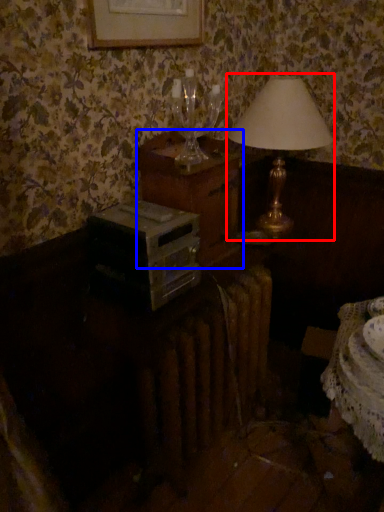
Question: Which point is further to the camera, lamp (highlighted by a red box) or nightstand (highlighted by a blue box)?

Choices:
 (A) lamp
 (B) nightstand

Answer: (A)